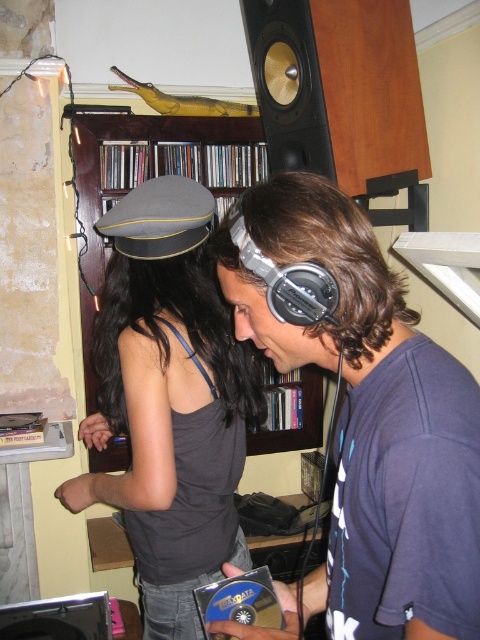
Which is more to the left, matte black headphones at center or wooden speaker at upper right?

matte black headphones at center

What do you see at coordinates (372, 420) in the screenshot? I see `matte black headphones at center` at bounding box center [372, 420].

This screenshot has height=640, width=480. What do you see at coordinates (372, 420) in the screenshot?
I see `matte black headphones at center` at bounding box center [372, 420].

Locate an element on the screen. The width and height of the screenshot is (480, 640). matte black headphones at center is located at coordinates (372, 420).

Between point (207, 317) and point (287, 122), which one is positioned in front?

Point (207, 317)

Is matte gray cap at center positioned behind wooden speaker at upper right?

No, matte gray cap at center is closer to the viewer.

Image resolution: width=480 pixels, height=640 pixels. What do you see at coordinates (168, 401) in the screenshot?
I see `matte gray cap at center` at bounding box center [168, 401].

Locate an element on the screen. matte gray cap at center is located at coordinates (168, 401).

Is wooden speaker at upper right thinner than wooden bookshelf at upper center?

Yes, wooden speaker at upper right is thinner than wooden bookshelf at upper center.

Who is more distant from viewer, [257,1] or [119,122]?

The point [119,122] is more distant.

Image resolution: width=480 pixels, height=640 pixels. I want to click on wooden speaker at upper right, so click(x=340, y=88).